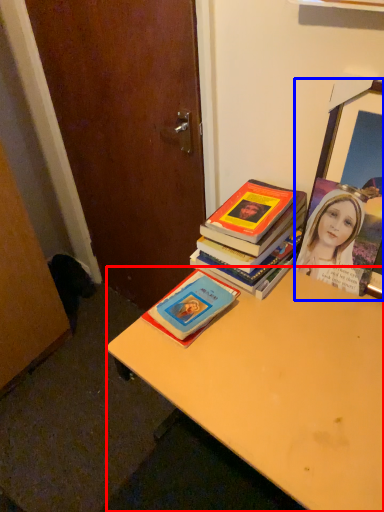
Question: Among these objects, which one is farthest to the camera, desk (highlighted by a red box) or picture frame (highlighted by a blue box)?

Choices:
 (A) desk
 (B) picture frame

Answer: (B)